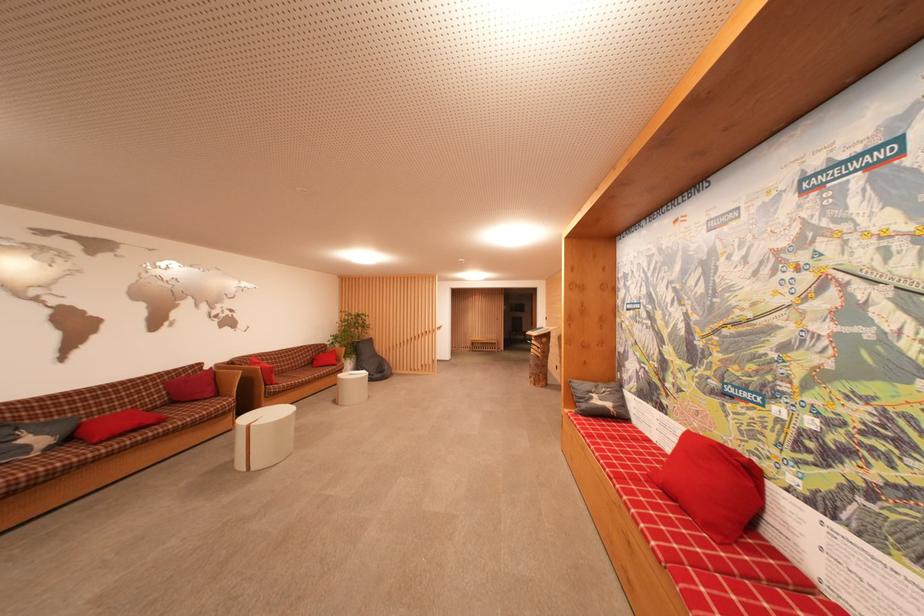
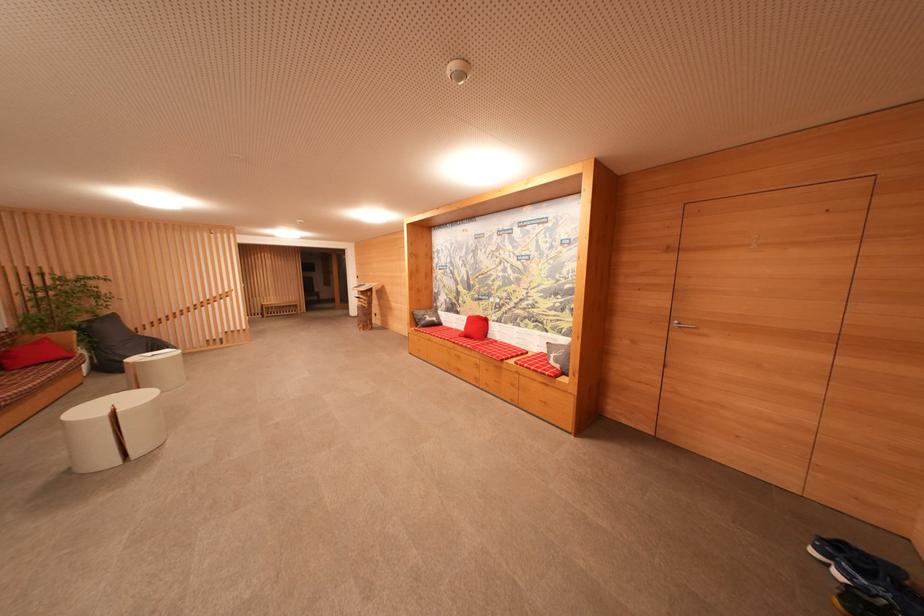
Where in the second image is the point corresponding to (338,354) from the first image?

(50, 342)